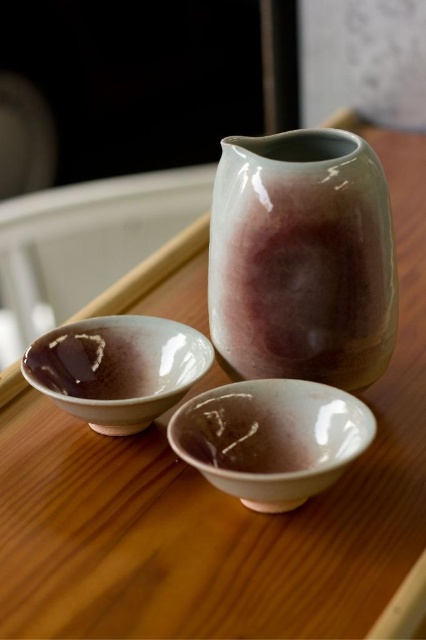
Between point (230, 253) and point (135, 348), which one is positioned in front?

Point (230, 253)

Consider the image. Is matte ceramic vase at center bigger than matte ceramic bowl at center?

Indeed, matte ceramic vase at center has a larger size compared to matte ceramic bowl at center.

Is point (233, 280) positioned before point (112, 337)?

Yes.

Image resolution: width=426 pixels, height=640 pixels. What are the coordinates of `matte ceramic vase at center` in the screenshot? It's located at (302, 259).

Describe the element at coordinates (302, 259) in the screenshot. I see `matte ceramic vase at center` at that location.

Is matte ceramic vase at center thinner than matte porcelain bowl at lower center?

No.

At what (x,y) coordinates should I click in order to perform the action: click on matte ceramic vase at center. Please return your answer as a coordinate pair (x, y). This screenshot has width=426, height=640. Looking at the image, I should click on (302, 259).

Where is `matte ceramic vase at center`? This screenshot has width=426, height=640. matte ceramic vase at center is located at coordinates (302, 259).

Which is more to the left, matte porcelain bowl at lower center or matte ceramic bowl at center?

Positioned to the left is matte ceramic bowl at center.

Between matte porcelain bowl at lower center and matte ceramic bowl at center, which one is positioned higher?

Positioned higher is matte ceramic bowl at center.

Between point (244, 410) and point (74, 412), which one is positioned in front?

Point (74, 412) is in front.

The width and height of the screenshot is (426, 640). Find the location of `matte porcelain bowl at lower center`. matte porcelain bowl at lower center is located at coordinates (271, 438).